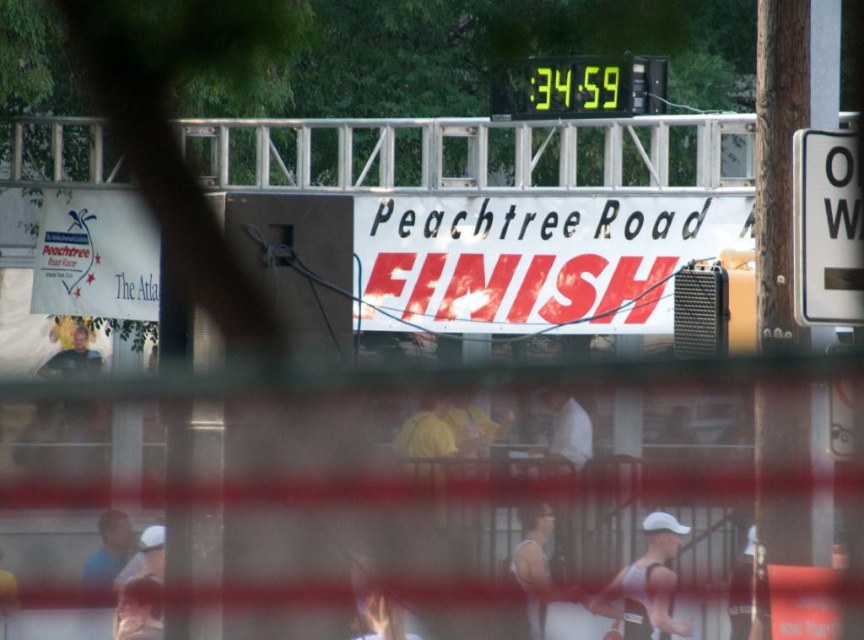
Does white paper sign at center appear on the left side of white fabric shirt at lower left?

No, white paper sign at center is not to the left of white fabric shirt at lower left.

Who is lower down, white paper sign at center or white fabric shirt at lower left?

white fabric shirt at lower left is below.

Is point (473, 204) closer to camera compared to point (154, 604)?

No, it is not.

Where is `white paper sign at center`? white paper sign at center is located at coordinates (532, 259).

Image resolution: width=864 pixels, height=640 pixels. What do you see at coordinates (532, 547) in the screenshot?
I see `white tank top at center` at bounding box center [532, 547].

Can you confirm if white tank top at center is thinner than yellow matte shirt at center?

Yes.

Does point (537, 525) come closer to viewer compared to point (414, 440)?

Yes, point (537, 525) is in front of point (414, 440).

I want to click on white tank top at center, so click(x=532, y=547).

Is white tank top at center positioned at the back of white fabric at center?

No.

Who is more distant from viewer, (541, 516) or (575, 445)?

Point (575, 445)

Locate an element on the screen. Image resolution: width=864 pixels, height=640 pixels. white tank top at center is located at coordinates (532, 547).